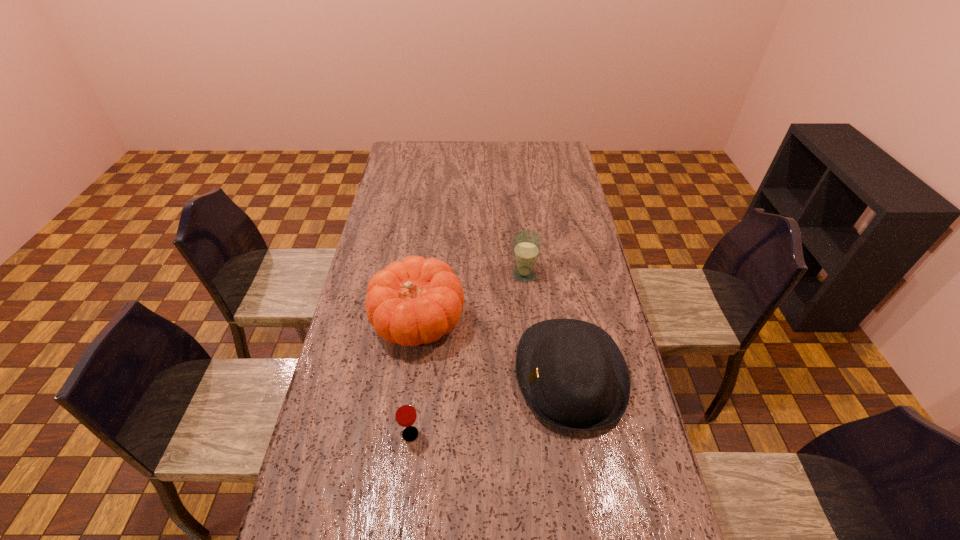
Locate an element on the screen. This screenshot has height=540, width=960. empty space that is in between the tallest object and the right glass is located at coordinates (471, 299).

Locate an element on the screen. Image resolution: width=960 pixels, height=540 pixels. free spot between the fedora and the tallest object is located at coordinates (494, 349).

Locate an element on the screen. This screenshot has width=960, height=540. free spot between the tallest object and the fedora is located at coordinates (494, 349).

You are a GUI agent. You are given a task and a screenshot of the screen. Output one action in this format:
    pyautogui.click(x=<x>, y=<y>)
    Task: Click on the blank region between the tallest object and the fedora
    This screenshot has height=540, width=960.
    Given the screenshot: What is the action you would take?
    pyautogui.click(x=494, y=349)

The width and height of the screenshot is (960, 540). Find the location of `unoccupied area between the fedora and the tallest object`. unoccupied area between the fedora and the tallest object is located at coordinates (494, 349).

Identify the location of vacant space that's between the farther glass and the nearer glass. (468, 354).

Where is `free space between the pumpkin and the farther glass`? free space between the pumpkin and the farther glass is located at coordinates (471, 299).

The image size is (960, 540). What are the coordinates of `the third closest object relative to the nearer glass` in the screenshot? It's located at (526, 244).

Where is `the closest object to the right glass`? The height and width of the screenshot is (540, 960). the closest object to the right glass is located at coordinates (417, 301).

Where is `vacant area in the image that satisfies the following two spatial constraints: 1. on the front-facing side of the fedora; 2. on the front side of the left glass`? The width and height of the screenshot is (960, 540). vacant area in the image that satisfies the following two spatial constraints: 1. on the front-facing side of the fedora; 2. on the front side of the left glass is located at coordinates (580, 434).